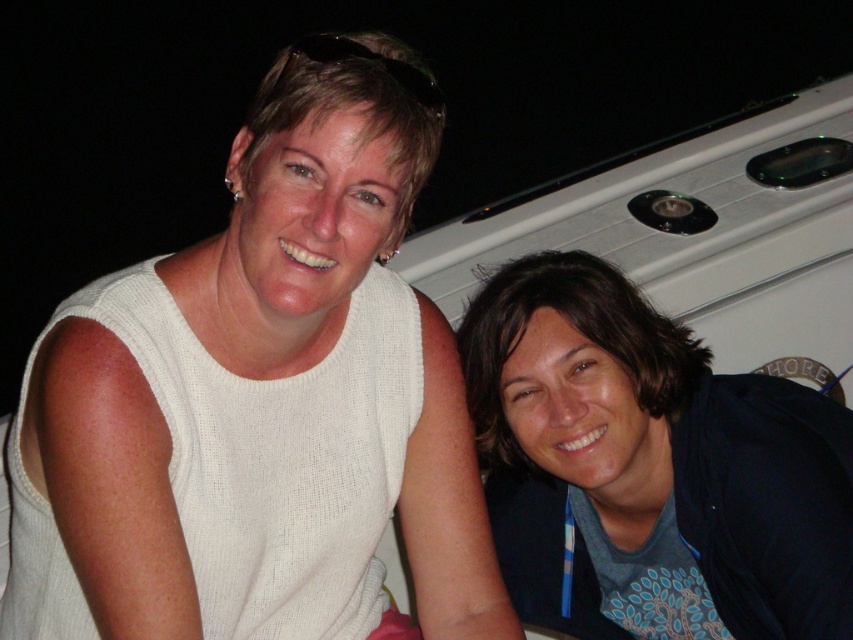
This screenshot has width=853, height=640. I want to click on white knitted sweater at upper left, so click(x=262, y=401).